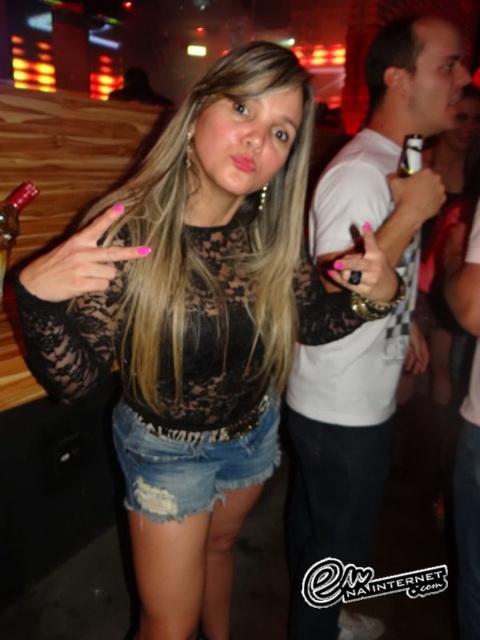
Between pink matte nails at center and metallic gold can opener at upper right, which one is positioned higher?

metallic gold can opener at upper right is higher up.

Describe the element at coordinates (79, 262) in the screenshot. Image resolution: width=480 pixels, height=640 pixels. I see `pink matte nails at center` at that location.

The width and height of the screenshot is (480, 640). Identify the location of pink matte nails at center. (79, 262).

Is white matte t-shirt at center to the left of metallic silver bottle at left from the viewer's perspective?

In fact, white matte t-shirt at center is to the right of metallic silver bottle at left.

Can you confirm if white matte t-shirt at center is positioned below metallic silver bottle at left?

Yes, white matte t-shirt at center is below metallic silver bottle at left.

Find the location of a particular element. The image size is (480, 640). white matte t-shirt at center is located at coordinates (362, 324).

Can you confirm if white matte t-shirt at center is positioned to the right of denim shorts at center?

Yes, white matte t-shirt at center is to the right of denim shorts at center.

Which is behind, point (365, 520) or point (208, 493)?

Positioned behind is point (365, 520).

Locate an element on the screen. white matte t-shirt at center is located at coordinates (362, 324).